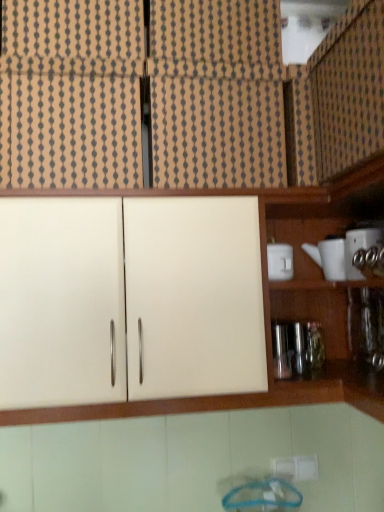
Question: Does point (357, 273) appear closer or farther from the camera than point (372, 49)?

Choices:
 (A) closer
 (B) farther

Answer: (B)

Question: Considering the positions of white glossy teapot at right, the 3th appliance in the left-to-right sequence, and matte wood cabinet at upper right, the 1th cabinetry in the top-to-bottom sequence, in the image, is white glossy teapot at right, the 3th appliance in the left-to-right sequence, bigger or smaller than matte wood cabinet at upper right, the 1th cabinetry in the top-to-bottom sequence,?

Choices:
 (A) big
 (B) small

Answer: (B)

Question: Based on their relative distances, which object is nearer to the matte white cabinet at center, the first cabinetry from the bottom?

Choices:
 (A) white glossy teapot at right, which is the first appliance from right to left
 (B) white matte cabinet at upper left, which appears as the second cabinetry when ordered from the bottom
 (C) matte wood cabinet at upper center, the second cabinetry when ordered from top to bottom
 (D) white glossy cup at upper right, arranged as the 1th appliance when viewed from the left
 (E) white ceramic teapot at right, which is the second appliance in left-to-right order

Answer: (B)

Question: Estimate the real-world distances between objects in this image. Which object is closer to the matte white cabinet at center, the first cabinetry from the bottom?

Choices:
 (A) white glossy teapot at right, the 3th appliance in the left-to-right sequence
 (B) metallic silver bottle at right
 (C) matte wood cabinet at upper center, the 3th cabinetry positioned from the bottom
 (D) white glossy cup at upper right, arranged as the 1th appliance when viewed from the left
 (E) white ceramic teapot at right, which ranks as the second appliance in right-to-left order

Answer: (C)